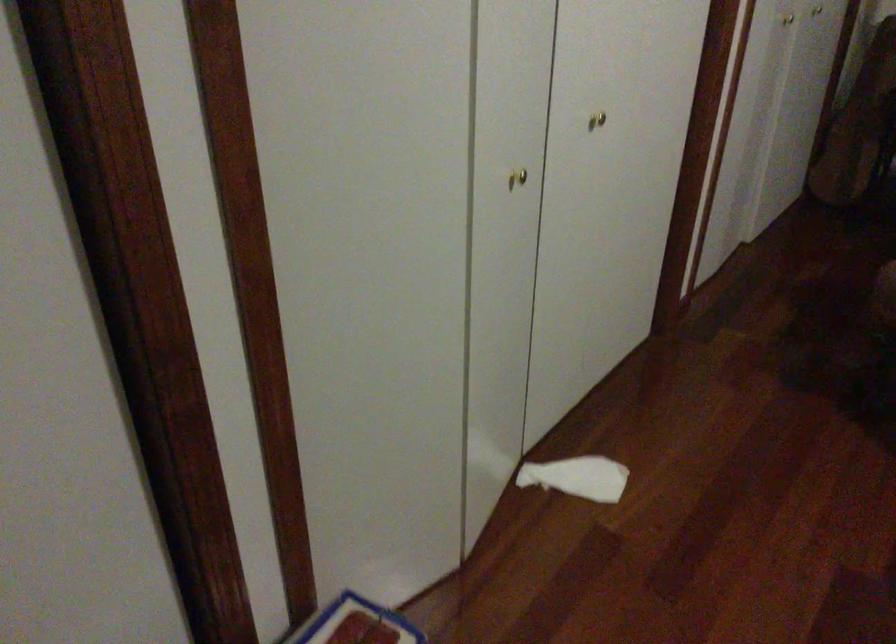
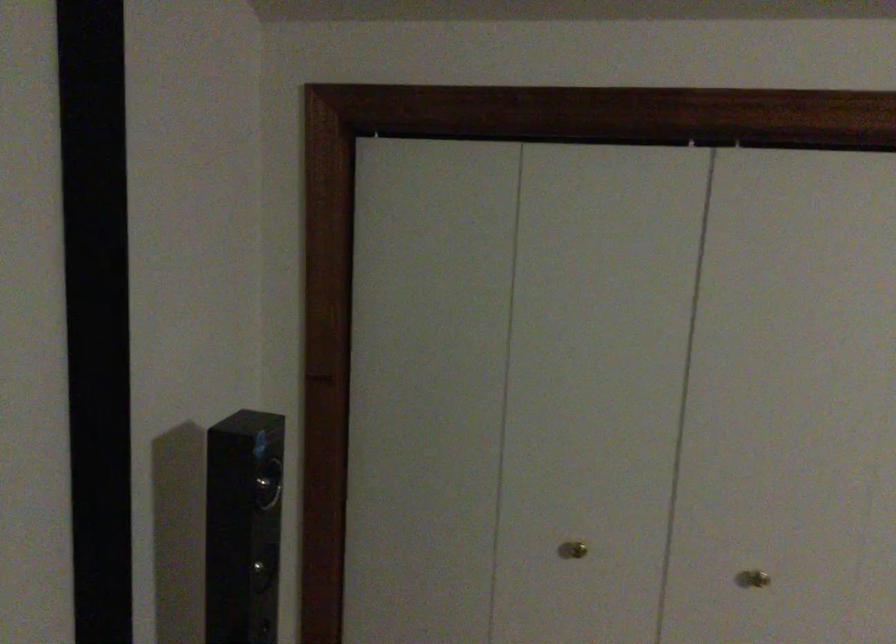
Question: The images are taken continuously from a first-person perspective. In which direction is your viewpoint rotating?

Choices:
 (A) Left
 (B) Right
 (C) Up
 (D) Down

Answer: (A)